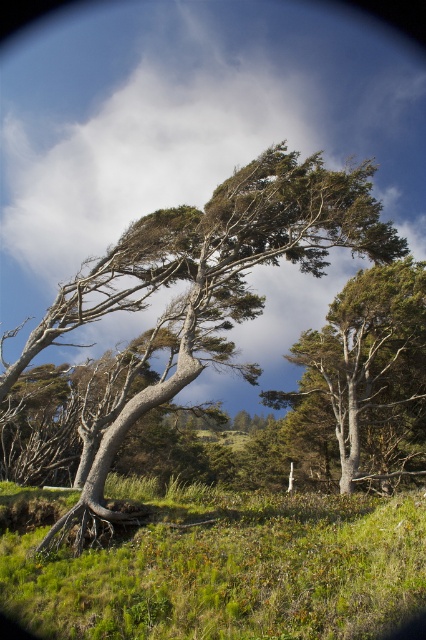
You are a gardener planning to mow the green grassy at lower left and the gray bark tree at center. Which area requires a wider mower path?

The gray bark tree at center requires a wider mower path because the green grassy at lower left has a smaller width compared to it.

You are standing in the natural landscape and want to walk from the point at coordinates point [54,572] to the point at coordinates point [391,465]. Which direction should you face to move towards the second point?

You should face towards the background of the scene because point [391,465] is further away from the camera compared to point [54,572].